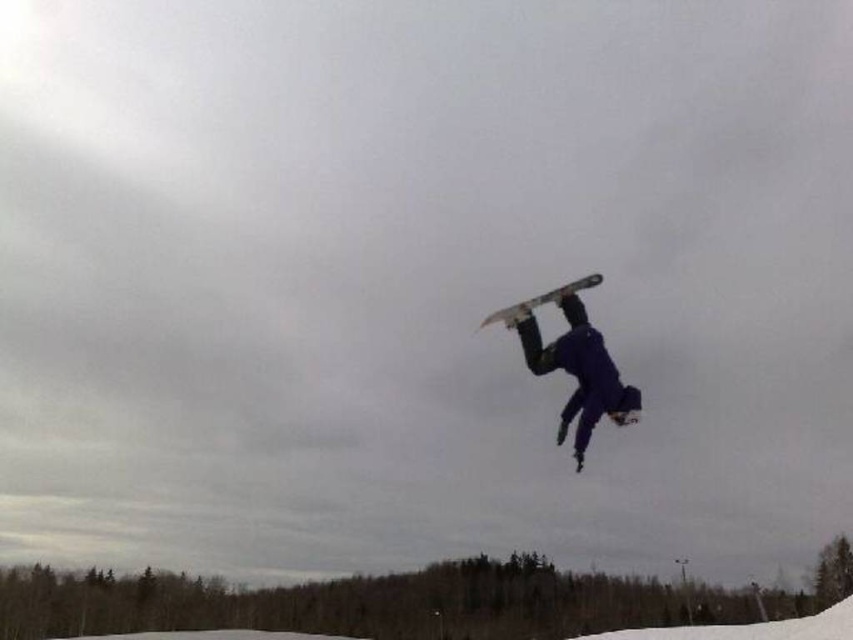
You are designing a snowboard rack that can hold both the matte black snowboard at center and the matte gray snowboard at center. Since both are at the center, how should you arrange them to ensure they don

The matte black snowboard at center is shorter than the matte gray snowboard at center, so you should place the matte gray snowboard at center first to accommodate its longer length, then position the matte black snowboard at center next to it.

You are a photographer trying to capture the snowboarder midair. You notice two snowboards in the scene. Which one is narrower between the matte black snowboard at center and the matte gray snowboard at center?

The matte black snowboard at center is narrower than the matte gray snowboard at center.

You are a photographer positioned at the camera location. You want to capture a closeup shot of the snowboarder who is at point (583,376). Considering the distance between you and the snowboarder, what is the minimum focal length you need to use to fill the frame with the snowboarder?

The minimum focal length required to capture a closeup shot of the snowboarder at point (583,376), who is 31.57 meters away, depends on the sensor size and field of view of your camera. However, without specific sensor dimensions, it is not possible to calculate an exact focal length. A longer focal length, such as 200mm or higher, would be necessary to achieve a closeup from that distance.